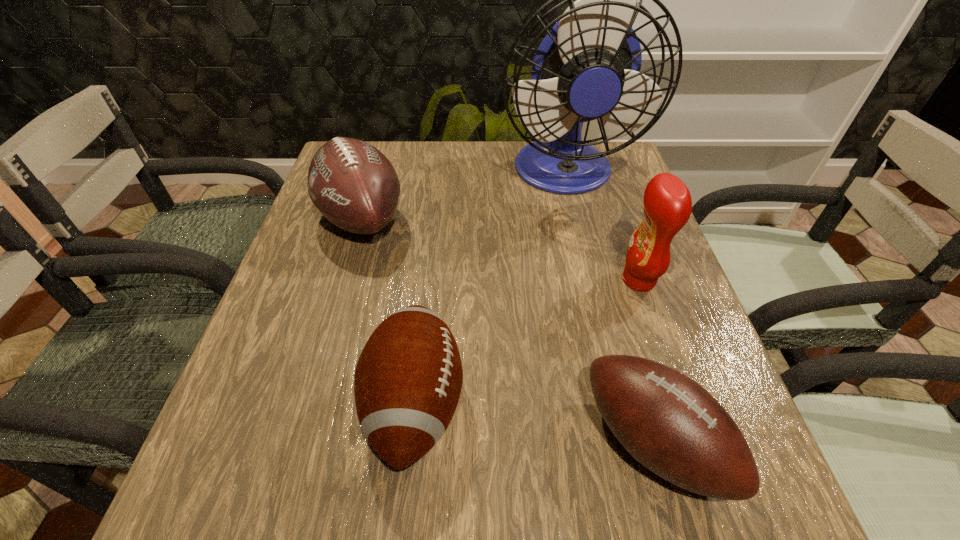
At what (x,y) coordinates should I click in order to perform the action: click on the tallest object. Please return your answer as a coordinate pair (x, y). This screenshot has width=960, height=540. Looking at the image, I should click on (587, 67).

At what (x,y) coordinates should I click in order to perform the action: click on the fourth shortest object. Please return your answer as a coordinate pair (x, y). This screenshot has width=960, height=540. Looking at the image, I should click on (667, 201).

Find the location of `the third farthest object`. the third farthest object is located at coordinates (667, 201).

Identify the location of the third tallest object. (354, 186).

The image size is (960, 540). Identify the location of the tallest football (American). (354, 186).

Where is `the rightmost football (American)`? The width and height of the screenshot is (960, 540). the rightmost football (American) is located at coordinates (670, 424).

Find the location of a particular element. The image size is (960, 540). vacant region located in front of the tallest object where the airflow is directed is located at coordinates (583, 253).

The width and height of the screenshot is (960, 540). Identify the location of free region located on the label side of the second tallest object. (514, 280).

Identify the location of vacant space situated 0.320m on the label side of the second tallest object. (466, 280).

Locate an element on the screen. free space located 0.360m on the label side of the second tallest object is located at coordinates point(445,280).